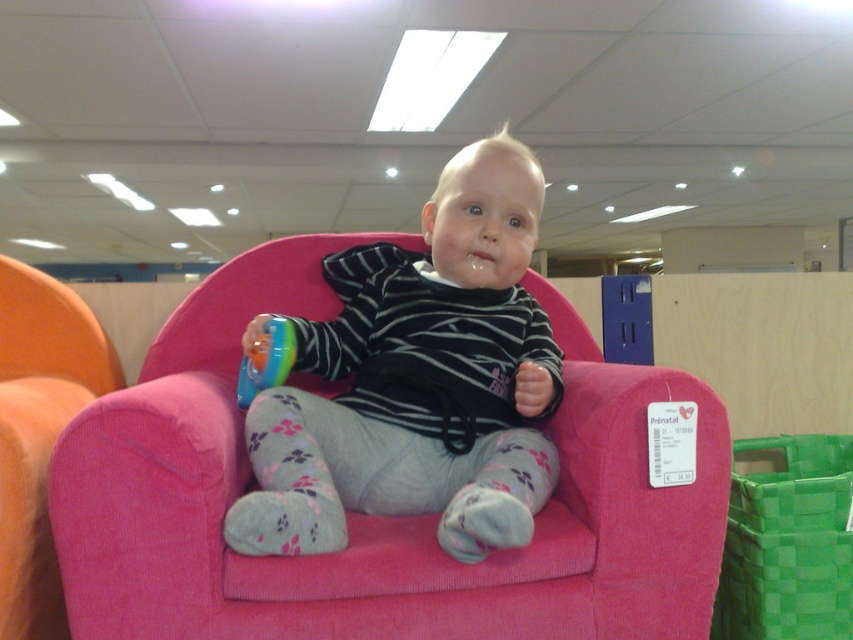
Question: Does pink fabric armchair at center appear on the right side of floral-patterned sock at lower center?

Choices:
 (A) no
 (B) yes

Answer: (B)

Question: Which point is farther from the camera taking this photo?

Choices:
 (A) (35, 332)
 (B) (438, 531)

Answer: (A)

Question: Is orange fabric armchair at left closer to camera compared to translucent plastic toy at center?

Choices:
 (A) yes
 (B) no

Answer: (A)

Question: Is pink fabric armchair at center below orange fabric armchair at left?

Choices:
 (A) yes
 (B) no

Answer: (B)

Question: Which of the following is the closest to the observer?

Choices:
 (A) (322, 397)
 (B) (292, 348)

Answer: (B)

Question: Which of the following is the closest to the observer?

Choices:
 (A) (277, 340)
 (B) (41, 288)
 (C) (300, 518)
 (D) (494, 476)

Answer: (C)